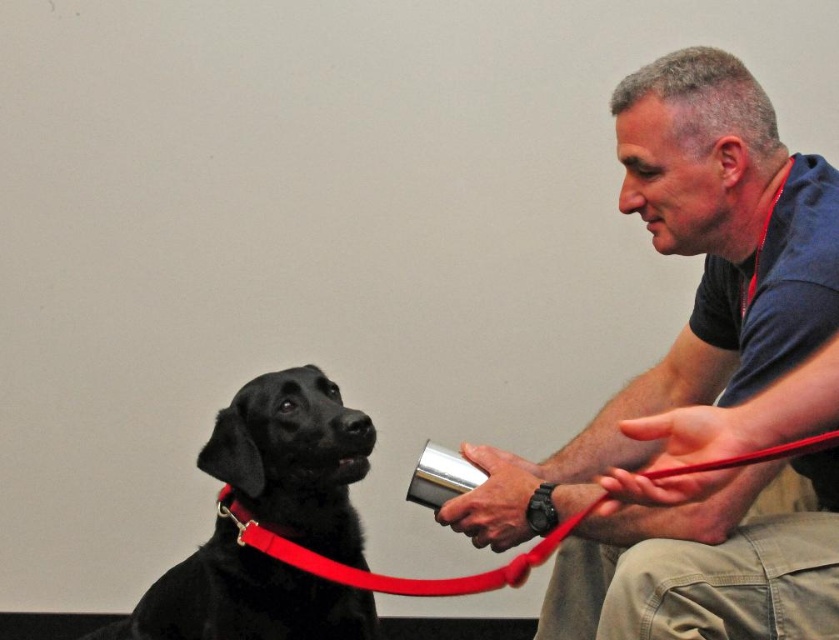
Question: Estimate the real-world distances between objects in this image. Which object is closer to the black smooth dog at left?

Choices:
 (A) matte black dog at left
 (B) red leather leash at lower left

Answer: (B)

Question: Estimate the real-world distances between objects in this image. Which object is farther from the black smooth dog at left?

Choices:
 (A) matte black dog at left
 (B) red leather leash at lower left

Answer: (A)

Question: Can you confirm if matte black dog at left is positioned to the left of red leather leash at lower left?

Choices:
 (A) no
 (B) yes

Answer: (A)

Question: Does black smooth dog at left have a larger size compared to red leather leash at lower left?

Choices:
 (A) no
 (B) yes

Answer: (A)

Question: Is black smooth dog at left below red leather leash at lower left?

Choices:
 (A) no
 (B) yes

Answer: (B)

Question: Which of the following is the farthest from the observer?

Choices:
 (A) red leather leash at lower left
 (B) matte black dog at left

Answer: (B)